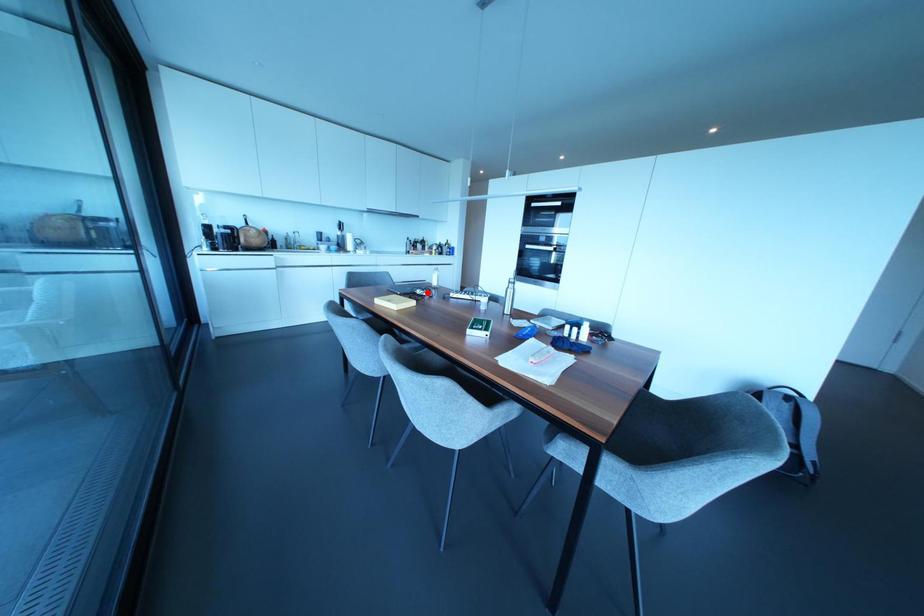
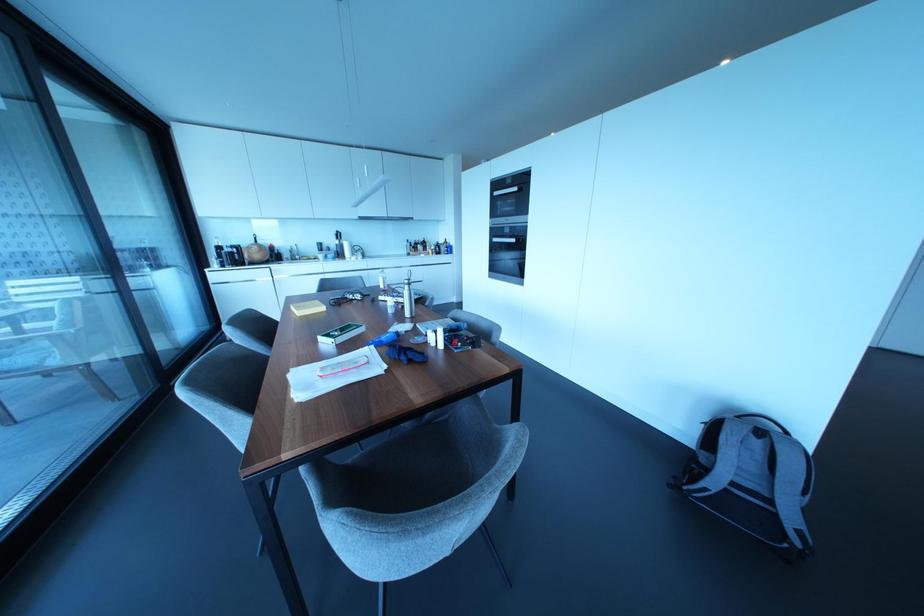
The point at the highlighted location is marked in the first image. Where is the corresponding point in the second image?

(358, 296)